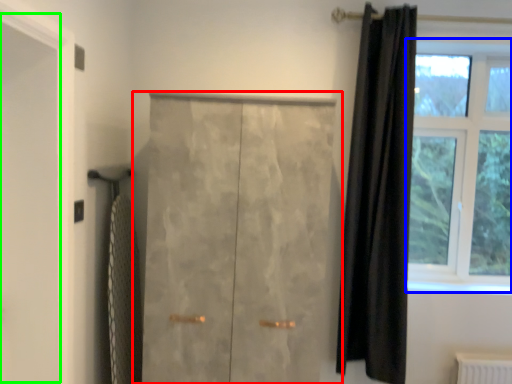
Question: Estimate the real-world distances between objects in this image. Which object is farther from door (highlighted by a red box), window (highlighted by a blue box) or screen door (highlighted by a green box)?

Choices:
 (A) window
 (B) screen door

Answer: (A)